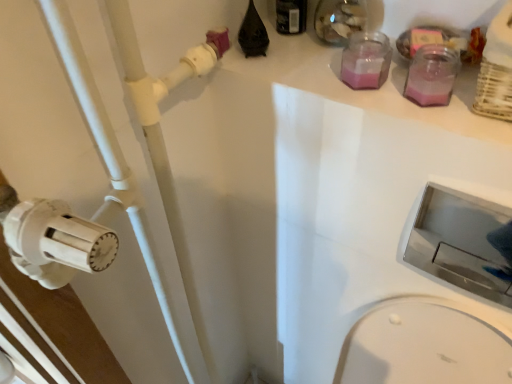
Question: Does black plastic bottle at upper center, the first bottle in the left-to-right sequence, have a smaller size compared to white plastic pipe at left?

Choices:
 (A) no
 (B) yes

Answer: (B)

Question: Considering the relative sizes of black plastic bottle at upper center, the first bottle in the left-to-right sequence, and white plastic pipe at left in the image provided, is black plastic bottle at upper center, the first bottle in the left-to-right sequence, thinner than white plastic pipe at left?

Choices:
 (A) no
 (B) yes

Answer: (B)

Question: Is black plastic bottle at upper center, which is the first bottle in top-to-bottom order, shorter than white plastic pipe at left?

Choices:
 (A) no
 (B) yes

Answer: (B)

Question: Does black plastic bottle at upper center, which is the first bottle in top-to-bottom order, have a greater height compared to white plastic pipe at left?

Choices:
 (A) no
 (B) yes

Answer: (A)

Question: From the image's perspective, does black plastic bottle at upper center, the first bottle in the left-to-right sequence, appear lower than white plastic pipe at left?

Choices:
 (A) no
 (B) yes

Answer: (A)

Question: From a real-world perspective, is black plastic bottle at upper center, which is counted as the second bottle, starting from the bottom, below white plastic pipe at left?

Choices:
 (A) no
 (B) yes

Answer: (A)

Question: From a real-world perspective, is pink glass jar at upper right, the second bottle in the top-to-bottom sequence, on top of white plastic pipe at left?

Choices:
 (A) no
 (B) yes

Answer: (B)

Question: Can you confirm if pink glass jar at upper right, which is the second bottle from left to right, is shorter than white plastic pipe at left?

Choices:
 (A) no
 (B) yes

Answer: (B)

Question: Is pink glass jar at upper right, which ranks as the 1th bottle in right-to-left order, positioned before white plastic pipe at left?

Choices:
 (A) yes
 (B) no

Answer: (B)

Question: Is pink glass jar at upper right, acting as the 1th bottle starting from the bottom, smaller than white plastic pipe at left?

Choices:
 (A) no
 (B) yes

Answer: (B)

Question: From a real-world perspective, is pink glass jar at upper right, acting as the 1th bottle starting from the bottom, located beneath white plastic pipe at left?

Choices:
 (A) no
 (B) yes

Answer: (A)

Question: Is pink glass jar at upper right, which ranks as the 1th bottle in right-to-left order, at the left side of white plastic pipe at left?

Choices:
 (A) yes
 (B) no

Answer: (B)

Question: Is black plastic bottle at upper center, which is counted as the second bottle, starting from the bottom, inside white plastic pipe at left?

Choices:
 (A) no
 (B) yes

Answer: (A)